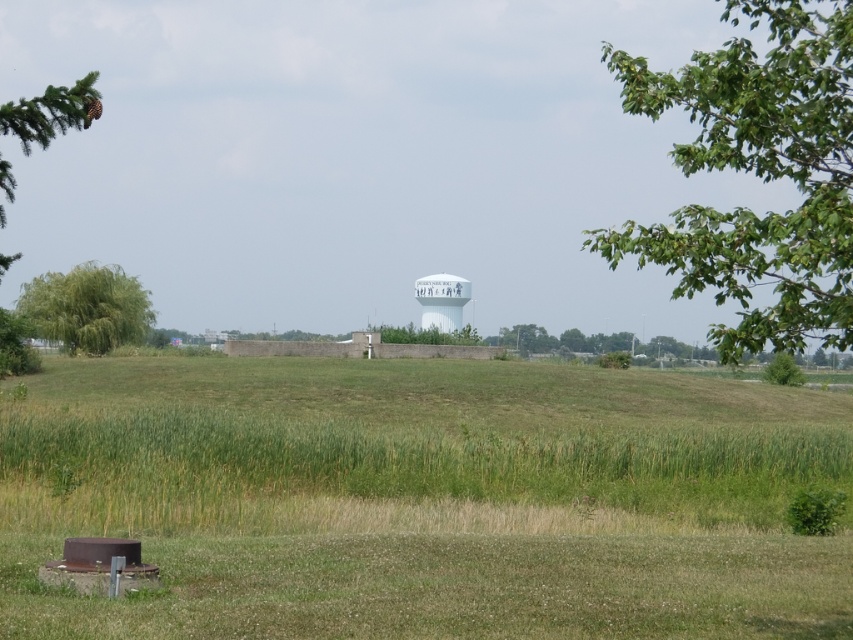
Between green leafy tree at upper right and green leafy tree at left, which one has less height?

green leafy tree at left

In the scene shown: Can you confirm if green leafy tree at upper right is taller than green leafy tree at left?

Indeed, green leafy tree at upper right has a greater height compared to green leafy tree at left.

I want to click on green leafy tree at upper right, so click(x=757, y=176).

Is green textured pine branch at upper left behind white glossy water tower at center?

That is False.

Between point (84, 80) and point (422, 314), which one is positioned in front?

Point (84, 80)

The image size is (853, 640). I want to click on green textured pine branch at upper left, so click(x=50, y=113).

Locate an element on the screen. green leafy tree at left is located at coordinates coord(86,307).

Who is positioned more to the left, green leafy tree at left or green textured pine branch at upper left?

From the viewer's perspective, green leafy tree at left appears more on the left side.

What are the coordinates of `green leafy tree at left` in the screenshot? It's located at (86, 307).